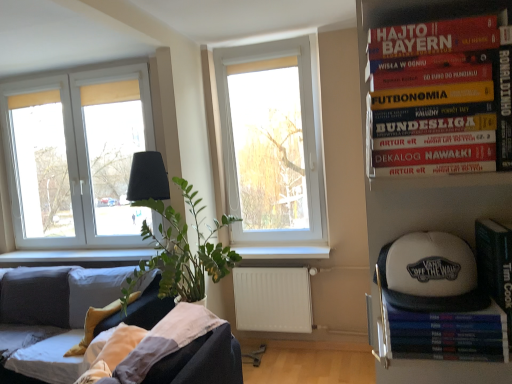
Find the location of a particular element. This screenshot has height=384, width=512. vacant point above white matte baseball cap at right, which is counted as the first paperback book, starting from the left (from a real-world perspective) is located at coordinates (436, 299).